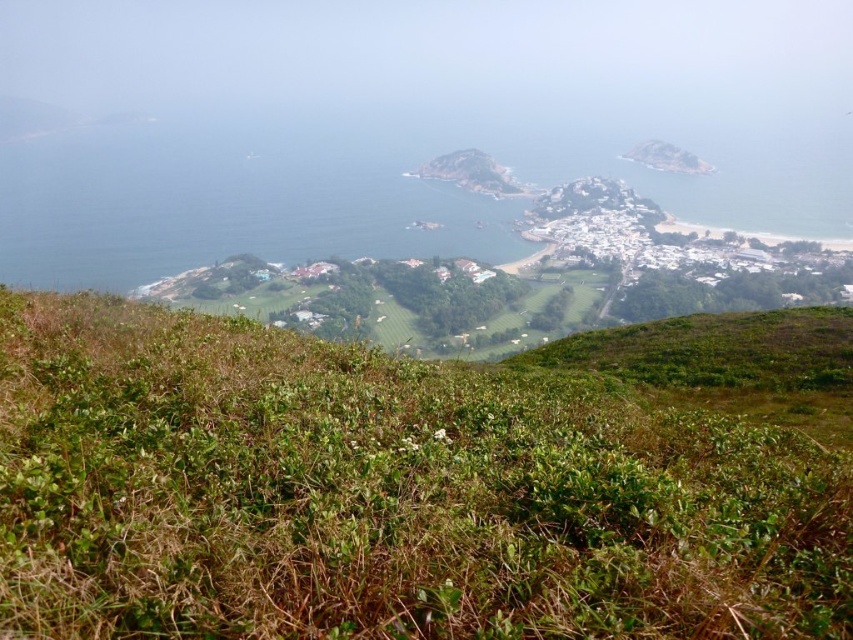
Question: Which of the following is the farthest from the observer?

Choices:
 (A) green leafy shrubs at center
 (B) blue water at center

Answer: (B)

Question: Estimate the real-world distances between objects in this image. Which object is farther from the rugged brown rock at center?

Choices:
 (A) blue water at center
 (B) green leafy shrubs at center

Answer: (B)

Question: Considering the relative positions of green leafy shrubs at center and blue water at center in the image provided, where is green leafy shrubs at center located with respect to blue water at center?

Choices:
 (A) left
 (B) right

Answer: (B)

Question: Can you confirm if green leafy shrubs at center is bigger than rugged brown rock at center?

Choices:
 (A) no
 (B) yes

Answer: (A)

Question: Estimate the real-world distances between objects in this image. Which object is farther from the rugged brown rock at center?

Choices:
 (A) blue water at center
 (B) green leafy shrubs at center

Answer: (B)

Question: Can you confirm if blue water at center is positioned to the right of rugged brown rock at center?

Choices:
 (A) no
 (B) yes

Answer: (A)